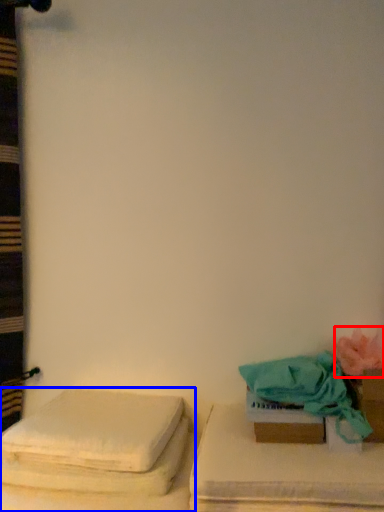
Question: Which point is closer to the camera, flower (highlighted by a red box) or furniture (highlighted by a blue box)?

Choices:
 (A) flower
 (B) furniture

Answer: (B)